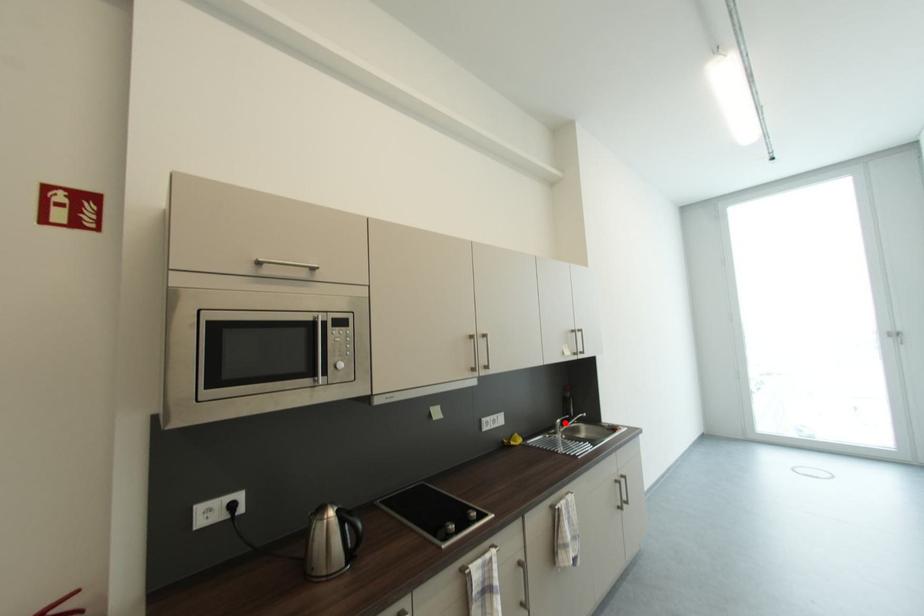
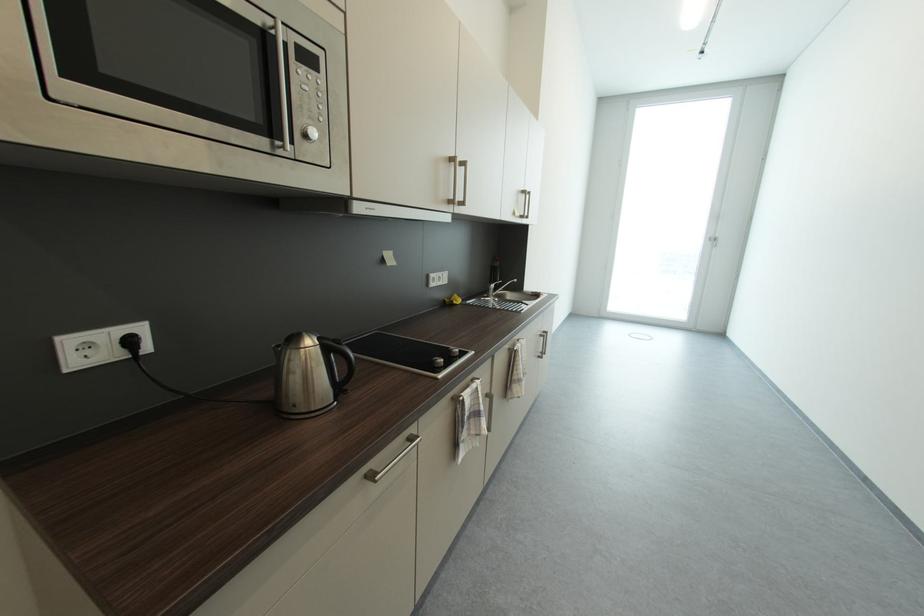
Question: I am providing you with two images of the same scene from different viewpoints. A red point is shown in image1. For the corresponding object point in image2, is it positioned nearer or farther from the camera?

Choices:
 (A) Nearer
 (B) Farther

Answer: (A)